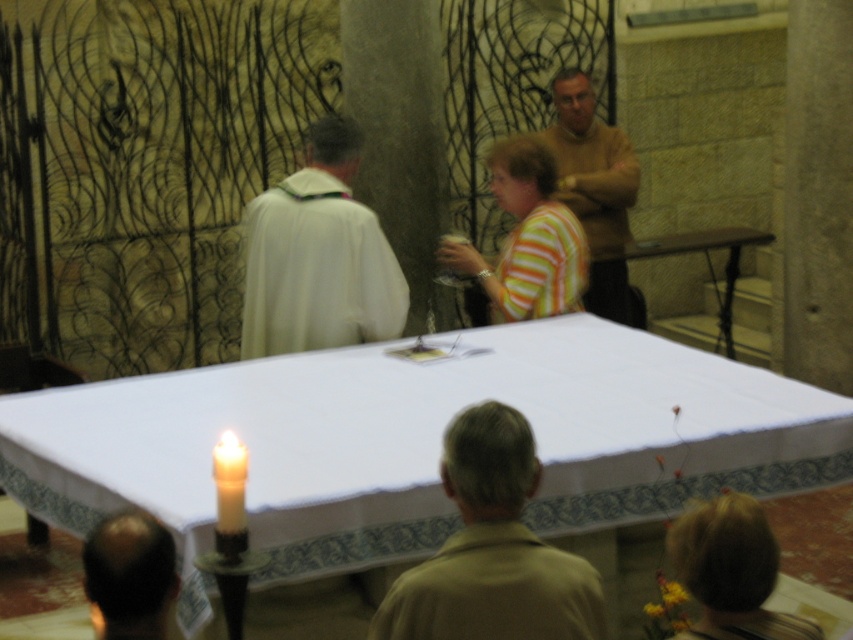
Question: Estimate the real-world distances between objects in this image. Which object is closer to the white clothed figure at center?

Choices:
 (A) bald head at lower left
 (B) beige sweater at upper right

Answer: (B)

Question: Which object is the farthest from the white wax candle at lower left?

Choices:
 (A) beige sweater at upper right
 (B) bald head at lower left
 (C) white clothed figure at center
 (D) tan matte shirt at lower center

Answer: (A)

Question: Is bald head at lower left to the right of white wax candle at lower left from the viewer's perspective?

Choices:
 (A) yes
 (B) no

Answer: (B)

Question: In this image, where is tan matte shirt at lower center located relative to beige sweater at upper right?

Choices:
 (A) left
 (B) right

Answer: (A)

Question: Is bald head at lower left below white wax candle at lower left?

Choices:
 (A) yes
 (B) no

Answer: (A)

Question: Which point is farther from the camera taking this photo?

Choices:
 (A) click(383, 605)
 (B) click(573, 172)
 (C) click(718, 400)

Answer: (B)